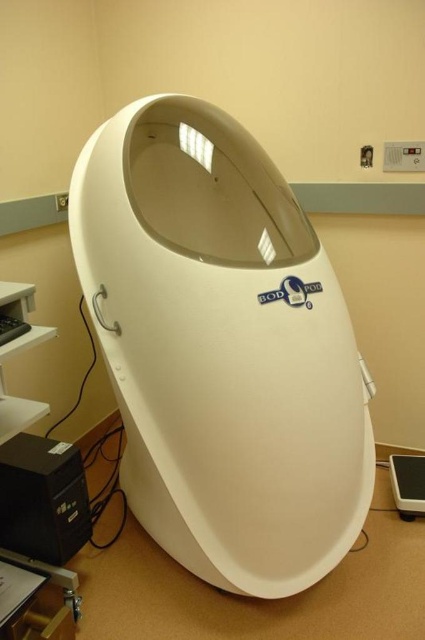
Can you confirm if white plastic pod at center is positioned above black plastic mouse at lower left?

Incorrect, white plastic pod at center is not positioned above black plastic mouse at lower left.

Is white plastic pod at center to the right of black plastic mouse at lower left from the viewer's perspective?

Yes, white plastic pod at center is to the right of black plastic mouse at lower left.

Does point (314, 349) come in front of point (2, 326)?

No.

In order to click on white plastic pod at center in this screenshot , I will do `click(221, 348)`.

Which of these two, black plastic tower at lower left or black plastic mouse at lower left, stands taller?

black plastic tower at lower left is taller.

Is black plastic tower at lower left smaller than black plastic mouse at lower left?

Actually, black plastic tower at lower left might be larger than black plastic mouse at lower left.

Image resolution: width=425 pixels, height=640 pixels. What are the coordinates of `black plastic tower at lower left` in the screenshot? It's located at (42, 499).

Describe the element at coordinates (221, 348) in the screenshot. I see `white plastic pod at center` at that location.

Does white plastic pod at center appear on the left side of white plastic scale at lower right?

Correct, you'll find white plastic pod at center to the left of white plastic scale at lower right.

Describe the element at coordinates (221, 348) in the screenshot. This screenshot has height=640, width=425. I see `white plastic pod at center` at that location.

You are a GUI agent. You are given a task and a screenshot of the screen. Output one action in this format:
    pyautogui.click(x=<x>, y=<y>)
    Task: Click on the white plastic pod at center
    This screenshot has width=425, height=640.
    Given the screenshot: What is the action you would take?
    click(x=221, y=348)